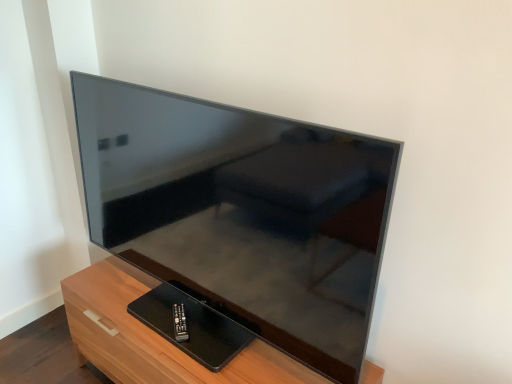
Question: Is wooden tv stand at lower left wider than black plastic remote at lower center?

Choices:
 (A) yes
 (B) no

Answer: (A)

Question: Is wooden tv stand at lower left turned away from black plastic remote at lower center?

Choices:
 (A) yes
 (B) no

Answer: (B)

Question: From the image's perspective, is wooden tv stand at lower left over black plastic remote at lower center?

Choices:
 (A) no
 (B) yes

Answer: (A)

Question: Is wooden tv stand at lower left placed right next to black plastic remote at lower center?

Choices:
 (A) no
 (B) yes

Answer: (A)

Question: Is the position of wooden tv stand at lower left more distant than that of black plastic remote at lower center?

Choices:
 (A) no
 (B) yes

Answer: (A)

Question: In terms of width, does wooden tv stand at lower left look wider or thinner when compared to matte black tv at center?

Choices:
 (A) thin
 (B) wide

Answer: (B)

Question: Considering the positions of wooden tv stand at lower left and matte black tv at center in the image, is wooden tv stand at lower left bigger or smaller than matte black tv at center?

Choices:
 (A) small
 (B) big

Answer: (A)

Question: From the image's perspective, is wooden tv stand at lower left above or below matte black tv at center?

Choices:
 (A) above
 (B) below

Answer: (B)

Question: Is point (136, 284) closer or farther from the camera than point (114, 114)?

Choices:
 (A) closer
 (B) farther

Answer: (B)

Question: Considering the positions of matte black tv at center and wooden tv stand at lower left in the image, is matte black tv at center taller or shorter than wooden tv stand at lower left?

Choices:
 (A) tall
 (B) short

Answer: (A)

Question: Considering their positions, is matte black tv at center located in front of or behind wooden tv stand at lower left?

Choices:
 (A) front
 (B) behind

Answer: (A)

Question: Considering the relative positions of matte black tv at center and wooden tv stand at lower left in the image provided, is matte black tv at center to the left or to the right of wooden tv stand at lower left?

Choices:
 (A) left
 (B) right

Answer: (B)

Question: Is point (244, 294) closer or farther from the camera than point (92, 317)?

Choices:
 (A) farther
 (B) closer

Answer: (B)

Question: Is point (181, 334) closer or farther from the camera than point (202, 134)?

Choices:
 (A) closer
 (B) farther

Answer: (B)

Question: From a real-world perspective, is black plastic remote at lower center positioned above or below matte black tv at center?

Choices:
 (A) below
 (B) above

Answer: (A)